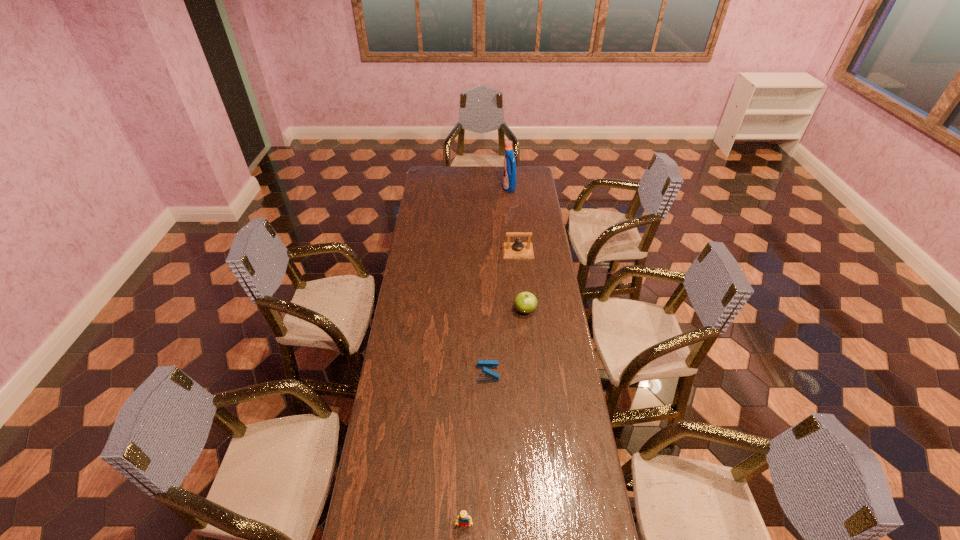
Find the location of a particular element. This screenshot has width=960, height=540. object that ranks as the third closest to the nearest object is located at coordinates (518, 249).

The image size is (960, 540). What are the coordinates of `object that stands as the third closest to the leftmost object` in the screenshot? It's located at (518, 249).

Locate an element on the screen. The width and height of the screenshot is (960, 540). free spot that satisfies the following two spatial constraints: 1. on the label of the detergent; 2. on the front-facing side of the nearest object is located at coordinates 540,525.

Locate an element on the screen. vacant space that satisfies the following two spatial constraints: 1. on the label of the bell; 2. on the right side of the detergent is located at coordinates (515, 251).

At what (x,y) coordinates should I click in order to perform the action: click on blank space that satisfies the following two spatial constraints: 1. on the label of the fourth nearest object; 2. on the left side of the farthest object. Please return your answer as a coordinate pair (x, y). This screenshot has width=960, height=540. Looking at the image, I should click on (515, 251).

Find the location of a particular element. Image resolution: width=960 pixels, height=540 pixels. vacant space that satisfies the following two spatial constraints: 1. on the label of the detergent; 2. on the right side of the bell is located at coordinates (515, 251).